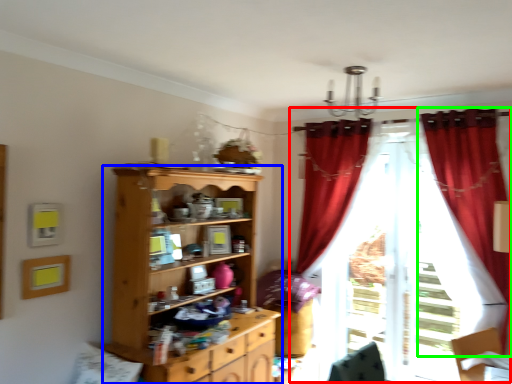
Question: Based on their relative distances, which object is farther from curtain (highlighted by a red box)? Choose from cupboard (highlighted by a blue box) and curtain (highlighted by a green box).

Choices:
 (A) cupboard
 (B) curtain

Answer: (A)